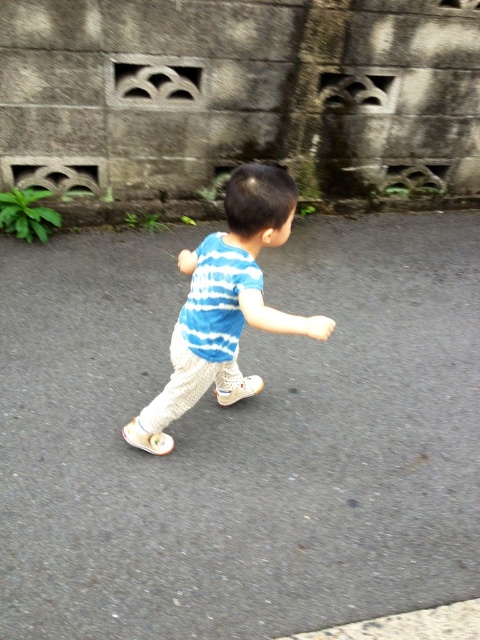
Question: Which point is farther from the camera taking this photo?

Choices:
 (A) (443, 481)
 (B) (240, 388)

Answer: (B)

Question: Can you confirm if gray asphalt pavement at center is bigger than blue striped shirt at center?

Choices:
 (A) no
 (B) yes

Answer: (B)

Question: Is gray asphalt pavement at center bigger than blue striped shirt at center?

Choices:
 (A) no
 (B) yes

Answer: (B)

Question: Is gray asphalt pavement at center above blue striped shirt at center?

Choices:
 (A) yes
 (B) no

Answer: (B)